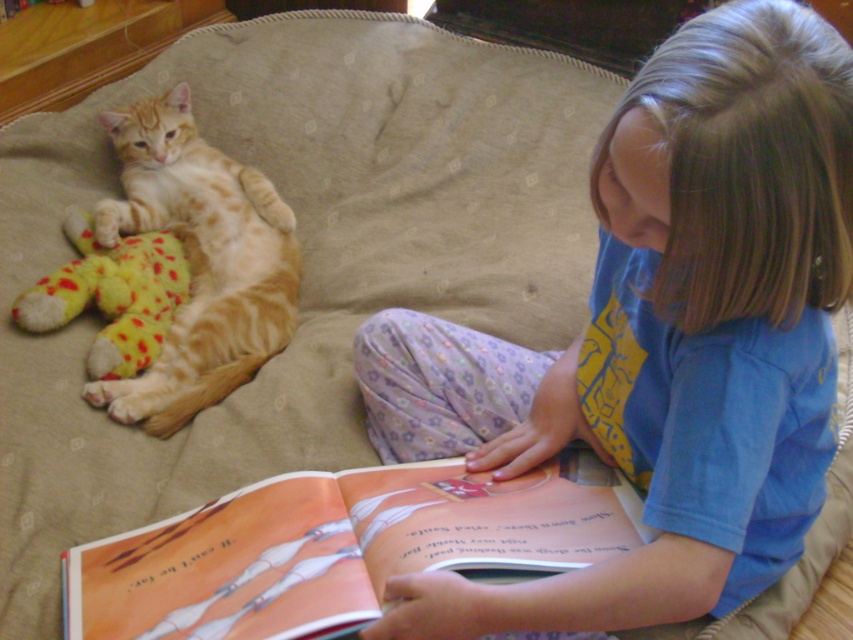
Can you confirm if orange tabby cat at left is positioned to the left of yellow plush toy at left?

Incorrect, orange tabby cat at left is not on the left side of yellow plush toy at left.

Between orange tabby cat at left and yellow plush toy at left, which one has less height?

yellow plush toy at left

Locate an element on the screen. The height and width of the screenshot is (640, 853). orange tabby cat at left is located at coordinates (198, 262).

This screenshot has height=640, width=853. I want to click on blue cotton shirt at center, so click(x=662, y=339).

Where is `blue cotton shirt at center`? blue cotton shirt at center is located at coordinates (662, 339).

Does matte orange book at lower center have a lesser height compared to yellow plush toy at left?

Yes, matte orange book at lower center is shorter than yellow plush toy at left.

Does matte orange book at lower center have a greater width compared to yellow plush toy at left?

Yes, matte orange book at lower center is wider than yellow plush toy at left.

Where is `matte orange book at lower center`? The image size is (853, 640). matte orange book at lower center is located at coordinates (339, 547).

In order to click on matte orange book at lower center in this screenshot , I will do [x=339, y=547].